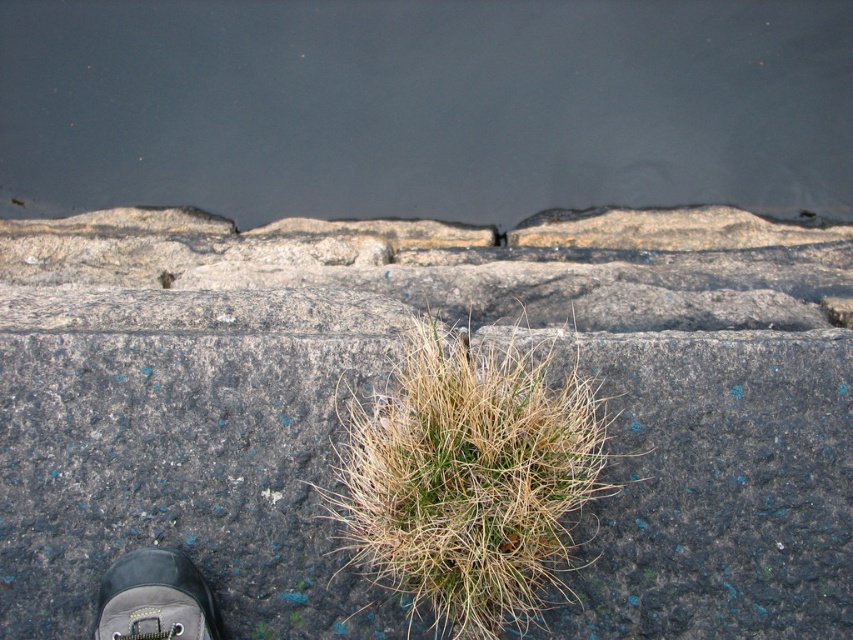
Question: Does dry grass at center appear on the left side of leather shoe at lower left?

Choices:
 (A) no
 (B) yes

Answer: (A)

Question: Based on their relative distances, which object is farther from the leather shoe at lower left?

Choices:
 (A) dry grass at center
 (B) gray concrete pavement at center

Answer: (A)

Question: Which point is farther to the camera?

Choices:
 (A) dry grass at center
 (B) leather shoe at lower left
 (C) gray concrete pavement at center

Answer: (C)

Question: From the image, what is the correct spatial relationship of gray concrete pavement at center in relation to leather shoe at lower left?

Choices:
 (A) left
 (B) right

Answer: (B)

Question: Does dry grass at center have a lesser width compared to leather shoe at lower left?

Choices:
 (A) no
 (B) yes

Answer: (A)

Question: Which point is farther to the camera?

Choices:
 (A) (300, 365)
 (B) (461, 442)
 (C) (119, 600)

Answer: (A)